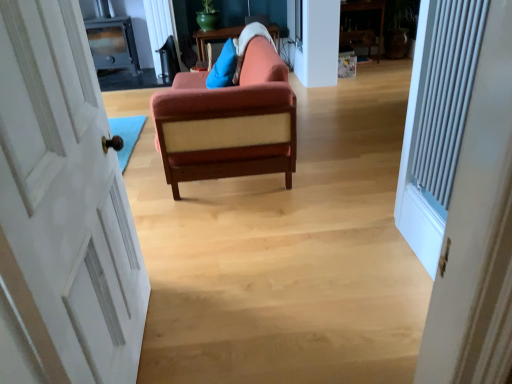
Question: Is velvet orange couch at center closer to camera compared to white textured radiator at right?

Choices:
 (A) no
 (B) yes

Answer: (A)

Question: Is white textured radiator at right a part of velvet orange couch at center?

Choices:
 (A) yes
 (B) no

Answer: (B)

Question: Is the depth of velvet orange couch at center greater than that of white textured radiator at right?

Choices:
 (A) no
 (B) yes

Answer: (B)

Question: Does velvet orange couch at center appear on the left side of white textured radiator at right?

Choices:
 (A) yes
 (B) no

Answer: (A)

Question: Is velvet orange couch at center thinner than white textured radiator at right?

Choices:
 (A) yes
 (B) no

Answer: (B)

Question: Is metallic wood stove at upper left inside the boundaries of white painted wood door at left, or outside?

Choices:
 (A) outside
 (B) inside

Answer: (A)

Question: Based on their positions, is metallic wood stove at upper left located to the left or right of white painted wood door at left?

Choices:
 (A) left
 (B) right

Answer: (A)

Question: From a real-world perspective, relative to white painted wood door at left, is metallic wood stove at upper left vertically above or below?

Choices:
 (A) above
 (B) below

Answer: (B)

Question: Is metallic wood stove at upper left wider or thinner than white painted wood door at left?

Choices:
 (A) thin
 (B) wide

Answer: (B)

Question: Visually, is white textured radiator at right positioned to the left or to the right of metallic wood stove at upper left?

Choices:
 (A) left
 (B) right

Answer: (B)

Question: Considering the positions of point (438, 24) and point (126, 44), is point (438, 24) closer or farther from the camera than point (126, 44)?

Choices:
 (A) farther
 (B) closer

Answer: (B)

Question: Is white textured radiator at right situated inside metallic wood stove at upper left or outside?

Choices:
 (A) inside
 (B) outside

Answer: (B)

Question: Considering their positions, is white textured radiator at right located in front of or behind metallic wood stove at upper left?

Choices:
 (A) front
 (B) behind

Answer: (A)

Question: Considering the positions of point (437, 210) and point (113, 314), is point (437, 210) closer or farther from the camera than point (113, 314)?

Choices:
 (A) closer
 (B) farther

Answer: (B)

Question: Looking at their shapes, would you say white textured radiator at right is wider or thinner than white painted wood door at left?

Choices:
 (A) wide
 (B) thin

Answer: (B)